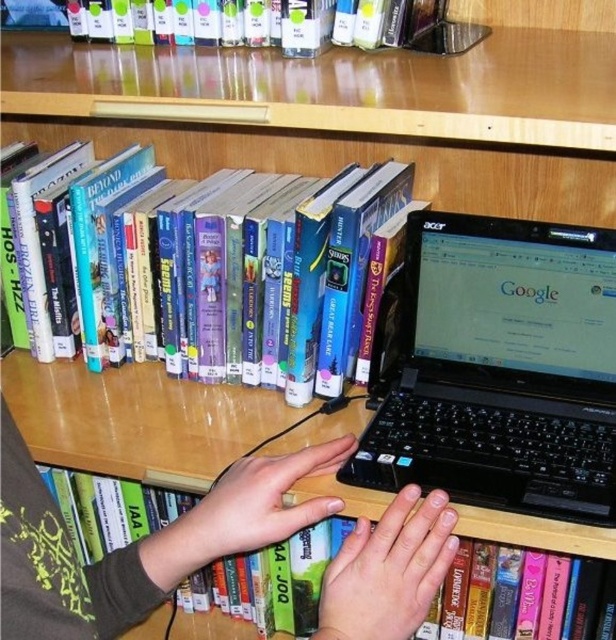
Question: Is hardcover book at center below hardcover book at upper center?

Choices:
 (A) yes
 (B) no

Answer: (A)

Question: Can you confirm if black plastic laptop at center is positioned to the right of green matte hands at center?

Choices:
 (A) no
 (B) yes

Answer: (B)

Question: Which is farther from the green matte hands at center?

Choices:
 (A) smooth skin hand at center
 (B) hardcover book at upper center
 (C) hardcover book at center

Answer: (B)

Question: Which point is farther to the camera?

Choices:
 (A) light skin hand at center
 (B) smooth skin hand at center

Answer: (A)

Question: Which point is farther from the camera taking this photo?

Choices:
 (A) click(x=261, y=536)
 (B) click(x=387, y=596)
 (C) click(x=227, y=515)

Answer: (A)

Question: Is light skin hand at center thinner than hardcover book at upper center?

Choices:
 (A) yes
 (B) no

Answer: (A)